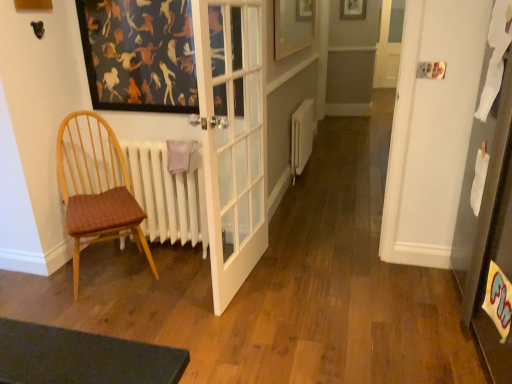
Image resolution: width=512 pixels, height=384 pixels. In order to click on wooden picture frame at upper center, which is counted as the first picture frame, starting from the top in this screenshot , I will do 353,9.

Measure the distance between wooden picture frame at upper center, positioned as the 2th picture frame in left-to-right order, and camera.

wooden picture frame at upper center, positioned as the 2th picture frame in left-to-right order, and camera are 6.15 meters apart.

The width and height of the screenshot is (512, 384). Describe the element at coordinates (168, 194) in the screenshot. I see `white matte radiator at left` at that location.

Describe the element at coordinates (301, 137) in the screenshot. The height and width of the screenshot is (384, 512). I see `white matte radiator at center` at that location.

Locate an element on the screen. The width and height of the screenshot is (512, 384). woven fabric chair at left is located at coordinates (96, 187).

Is white matte radiator at center taller than woven fabric chair at left?

No.

Considering the sizes of objects white matte radiator at center and woven fabric chair at left in the image provided, who is bigger, white matte radiator at center or woven fabric chair at left?

Bigger between the two is woven fabric chair at left.

Which object is further away from the camera, white matte radiator at center or woven fabric chair at left?

white matte radiator at center is more distant.

At what (x,y) coordinates should I click in order to perform the action: click on chair above the white matte radiator at center (from a real-world perspective). Please return your answer as a coordinate pair (x, y). Looking at the image, I should click on (96, 187).

From the image's perspective, is white matte radiator at center beneath wooden picture frame at upper center, acting as the 2th picture frame starting from the front?

Yes, from the image's perspective, white matte radiator at center is below wooden picture frame at upper center, acting as the 2th picture frame starting from the front.

Is white matte radiator at center far from wooden picture frame at upper center, positioned as the 2th picture frame in left-to-right order?

white matte radiator at center is positioned a significant distance from wooden picture frame at upper center, positioned as the 2th picture frame in left-to-right order.

Considering the relative sizes of white matte radiator at center and wooden picture frame at upper center, which is counted as the first picture frame, starting from the top, in the image provided, is white matte radiator at center taller than wooden picture frame at upper center, which is counted as the first picture frame, starting from the top,?

Yes.

Does white matte radiator at center have a lesser width compared to wooden picture frame at upper center, positioned as the 2th picture frame in left-to-right order?

No.

Are white matte radiator at left and wooden picture frame at upper center, which is counted as the first picture frame, starting from the top, making contact?

No, white matte radiator at left is not in contact with wooden picture frame at upper center, which is counted as the first picture frame, starting from the top.

What's the angular difference between white matte radiator at left and wooden picture frame at upper center, which is the first picture frame in back-to-front order,'s facing directions?

The facing directions of white matte radiator at left and wooden picture frame at upper center, which is the first picture frame in back-to-front order, are 0.127 degrees apart.

Is white matte radiator at left aimed at wooden picture frame at upper center, positioned as the 2th picture frame in left-to-right order?

No, white matte radiator at left is not aimed at wooden picture frame at upper center, positioned as the 2th picture frame in left-to-right order.

From a real-world perspective, is white matte radiator at left below wooden picture frame at upper center, acting as the 2th picture frame starting from the front?

Indeed, from a real-world perspective, white matte radiator at left is positioned beneath wooden picture frame at upper center, acting as the 2th picture frame starting from the front.

What's the angular difference between white matte radiator at left and white matte radiator at center's facing directions?

88.4 degrees separate the facing orientations of white matte radiator at left and white matte radiator at center.

Based on the photo, is white matte radiator at left taller than white matte radiator at center?

Correct, white matte radiator at left is much taller as white matte radiator at center.

Is white matte radiator at left looking in the opposite direction of white matte radiator at center?

Correct, white matte radiator at left is looking away from white matte radiator at center.

Is white matte radiator at left not close to white matte radiator at center?

Yes, white matte radiator at left and white matte radiator at center are located far from each other.

Can you confirm if white matte radiator at left is wider than woven fabric chair at left?

In fact, white matte radiator at left might be narrower than woven fabric chair at left.

Is point (133, 166) positioned in front of point (77, 194)?

That is False.

From the image's perspective, between white matte radiator at left and woven fabric chair at left, which one is located above?

white matte radiator at left appears higher in the image.

Are white matte radiator at left and woven fabric chair at left beside each other?

No, white matte radiator at left is not next to woven fabric chair at left.

Does white matte radiator at left have a greater width compared to wooden picture frame at upper center, the 2th picture frame when ordered from top to bottom?

Yes.

From the image's perspective, is white matte radiator at left positioned above or below wooden picture frame at upper center, which is the 2th picture frame in back-to-front order?

Answer: Based on their image positions, white matte radiator at left is located beneath wooden picture frame at upper center, which is the 2th picture frame in back-to-front order.

Based on the photo, is white matte radiator at left in front of wooden picture frame at upper center, the 2th picture frame when ordered from top to bottom?

Yes, it is.

Between point (182, 228) and point (288, 8), which one is positioned in front?

Point (182, 228)

In the image, is woven fabric chair at left positioned in front of or behind wooden picture frame at upper center, acting as the first picture frame starting from the left?

woven fabric chair at left is in front of wooden picture frame at upper center, acting as the first picture frame starting from the left.

Is woven fabric chair at left not near wooden picture frame at upper center, placed as the second picture frame when sorted from right to left?

Indeed, woven fabric chair at left is not near wooden picture frame at upper center, placed as the second picture frame when sorted from right to left.

Does point (85, 204) come farther from viewer compared to point (307, 1)?

No, it is in front of (307, 1).

Is woven fabric chair at left turned away from wooden picture frame at upper center, placed as the second picture frame when sorted from right to left?

woven fabric chair at left is not turned away from wooden picture frame at upper center, placed as the second picture frame when sorted from right to left.

In order to click on heater above the woven fabric chair at left (from the image's perspective) in this screenshot , I will do `click(301, 137)`.

Find the location of a particular element. This screenshot has width=512, height=384. heater below the wooden picture frame at upper center, which is counted as the first picture frame, starting from the top (from the image's perspective) is located at coordinates (301, 137).

Looking at the image, which one is located further to white matte radiator at center, wooden picture frame at upper center, which is the first picture frame in back-to-front order, or white matte radiator at left?

Based on the image, wooden picture frame at upper center, which is the first picture frame in back-to-front order, appears to be further to white matte radiator at center.

In the scene shown: When comparing their distances from woven fabric chair at left, does white matte radiator at center or wooden picture frame at upper center, which is counted as the first picture frame, starting from the top, seem further?

wooden picture frame at upper center, which is counted as the first picture frame, starting from the top, lies further to woven fabric chair at left than the other object.

Considering their positions, is woven fabric chair at left positioned closer to white matte radiator at left than wooden picture frame at upper center, acting as the 2th picture frame starting from the front?

woven fabric chair at left is positioned closer to the anchor white matte radiator at left.

Which object lies further to the anchor point wooden picture frame at upper center, which is counted as the first picture frame, starting from the top, white matte radiator at left or wooden picture frame at upper center, the 2th picture frame when ordered from top to bottom?

white matte radiator at left lies further to wooden picture frame at upper center, which is counted as the first picture frame, starting from the top, than the other object.

From the image, which object appears to be nearer to wooden picture frame at upper center, which is counted as the first picture frame, starting from the top, white matte radiator at center or woven fabric chair at left?

The object closer to wooden picture frame at upper center, which is counted as the first picture frame, starting from the top, is white matte radiator at center.

Which object lies nearer to the anchor point white matte radiator at center, wooden picture frame at upper center, which ranks as the first picture frame in front-to-back order, or white matte radiator at left?

wooden picture frame at upper center, which ranks as the first picture frame in front-to-back order, lies closer to white matte radiator at center than the other object.

Looking at the image, which one is located further to wooden picture frame at upper center, which is the 1th picture frame in bottom-to-top order, wooden picture frame at upper center, which is the first picture frame in back-to-front order, or white matte radiator at center?

The object further to wooden picture frame at upper center, which is the 1th picture frame in bottom-to-top order, is wooden picture frame at upper center, which is the first picture frame in back-to-front order.

Looking at the image, which one is located further to wooden picture frame at upper center, the 2th picture frame when ordered from top to bottom, white matte radiator at left or white matte radiator at center?

white matte radiator at left.

The height and width of the screenshot is (384, 512). Identify the location of picture frame located between woven fabric chair at left and wooden picture frame at upper center, the 1th picture frame viewed from the right, in the depth direction. (293, 26).

Where is `radiator between woven fabric chair at left and white matte radiator at center along the z-axis`? The image size is (512, 384). radiator between woven fabric chair at left and white matte radiator at center along the z-axis is located at coordinates (168, 194).

This screenshot has height=384, width=512. I want to click on heater located between woven fabric chair at left and wooden picture frame at upper center, which is counted as the first picture frame, starting from the top, in the depth direction, so click(x=301, y=137).

In order to click on picture frame between woven fabric chair at left and white matte radiator at center from front to back in this screenshot , I will do `click(293, 26)`.